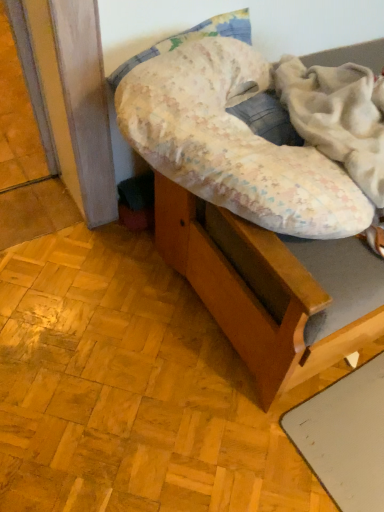
Question: From a real-world perspective, is fluffy white blanket at upper right below wooden bed frame at center?

Choices:
 (A) no
 (B) yes

Answer: (A)

Question: From the image's perspective, is fluffy white blanket at upper right under wooden bed frame at center?

Choices:
 (A) yes
 (B) no

Answer: (A)

Question: Can you confirm if fluffy white blanket at upper right is wider than wooden bed frame at center?

Choices:
 (A) no
 (B) yes

Answer: (A)

Question: Is fluffy white blanket at upper right positioned behind wooden bed frame at center?

Choices:
 (A) no
 (B) yes

Answer: (A)

Question: Is fluffy white blanket at upper right turned away from wooden bed frame at center?

Choices:
 (A) no
 (B) yes

Answer: (A)

Question: Is fluffy white blanket at upper right not close to wooden bed frame at center?

Choices:
 (A) yes
 (B) no

Answer: (B)

Question: Is fluffy white blanket at upper right located within wooden bed frame at center?

Choices:
 (A) no
 (B) yes

Answer: (B)

Question: Can we say wooden bed frame at center lies outside fluffy white blanket at upper right?

Choices:
 (A) yes
 (B) no

Answer: (A)

Question: Considering the relative sizes of wooden bed frame at center and fluffy white blanket at upper right in the image provided, is wooden bed frame at center shorter than fluffy white blanket at upper right?

Choices:
 (A) no
 (B) yes

Answer: (A)

Question: From a real-world perspective, is wooden bed frame at center below fluffy white blanket at upper right?

Choices:
 (A) no
 (B) yes

Answer: (B)

Question: Does wooden bed frame at center come in front of fluffy white blanket at upper right?

Choices:
 (A) no
 (B) yes

Answer: (A)

Question: Can you see wooden bed frame at center touching fluffy white blanket at upper right?

Choices:
 (A) no
 (B) yes

Answer: (A)

Question: Is fluffy white blanket at upper right wider or thinner than wooden bed frame at center?

Choices:
 (A) wide
 (B) thin

Answer: (B)